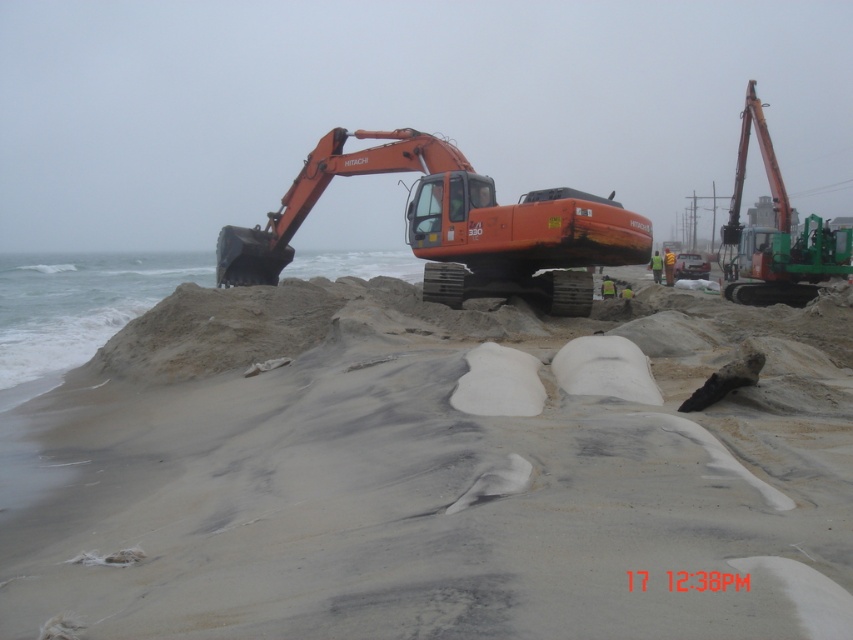
How distant is smooth sand at center from orange metallic excavator at center?

A distance of 4.73 meters exists between smooth sand at center and orange metallic excavator at center.

Is smooth sand at center below orange metallic excavator at center?

Indeed, smooth sand at center is positioned under orange metallic excavator at center.

Is point (635, 442) closer to viewer compared to point (282, 198)?

Yes, point (635, 442) is closer to viewer.

Identify the location of smooth sand at center. (433, 472).

Is point (442, 152) positioned in front of point (817, 259)?

That is True.

Which is behind, point (474, 212) or point (733, 182)?

The point (733, 182) is more distant.

What are the coordinates of `orange metallic excavator at center` in the screenshot? It's located at (454, 227).

Which of these two, smooth sand at center or orange metallic excavator at right, stands shorter?

With less height is smooth sand at center.

Between point (593, 396) and point (804, 252), which one is positioned in front?

Point (593, 396)

Who is more forward, (x=695, y=372) or (x=730, y=240)?

Positioned in front is point (x=695, y=372).

Locate an element on the screen. This screenshot has height=640, width=853. smooth sand at center is located at coordinates (433, 472).